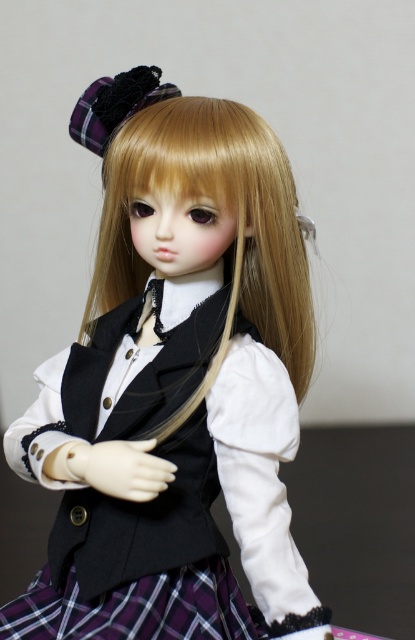
Which is more to the right, blonde silky hair at center or plaid fabric at center?

Positioned to the right is blonde silky hair at center.

Is blonde silky hair at center shorter than plaid fabric at center?

No.

Who is more forward, (280,337) or (41,604)?

Point (41,604) is in front.

I want to click on blonde silky hair at center, so click(219, 209).

Is matte black vest at center taller than blonde silky hair at center?

Correct, matte black vest at center is much taller as blonde silky hair at center.

Is matte black vest at center to the left of blonde silky hair at center from the viewer's perspective?

Incorrect, matte black vest at center is not on the left side of blonde silky hair at center.

Image resolution: width=415 pixels, height=640 pixels. I want to click on matte black vest at center, so click(x=175, y=388).

Does matte black vest at center have a greater width compared to plaid fabric at center?

Yes.

Can you confirm if matte black vest at center is taller than plaid fabric at center?

Yes.

This screenshot has height=640, width=415. Find the location of `matte black vest at center`. matte black vest at center is located at coordinates (175, 388).

The width and height of the screenshot is (415, 640). I want to click on matte black vest at center, so click(175, 388).